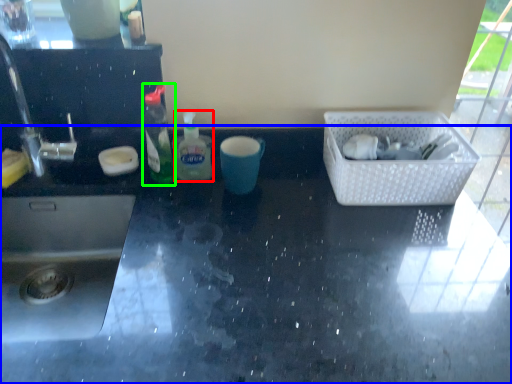
Question: Which object is positioned farthest from bottle (highlighted by a red box)? Select from countertop (highlighted by a blue box) and bottle (highlighted by a green box).

Choices:
 (A) countertop
 (B) bottle

Answer: (A)